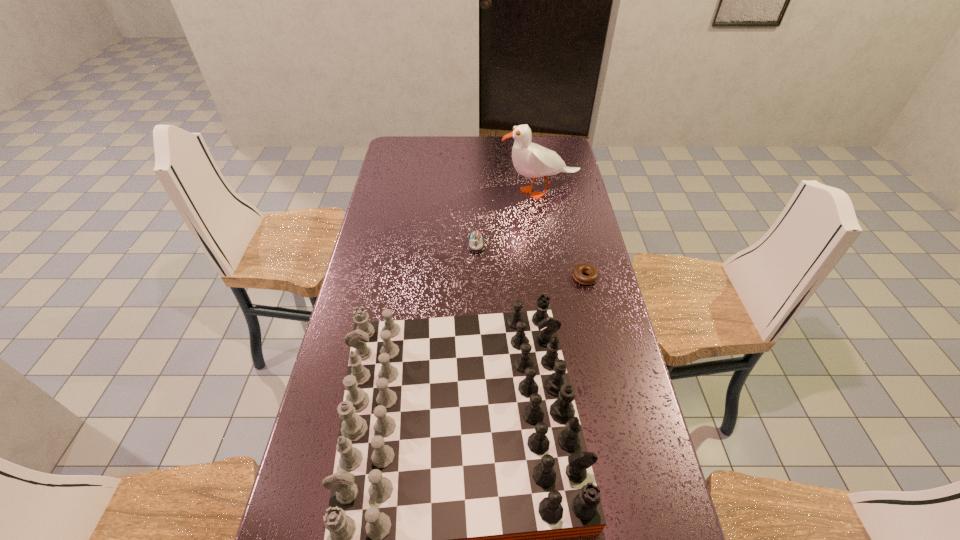
Where is `the tallest object`? the tallest object is located at coordinates (531, 160).

This screenshot has width=960, height=540. I want to click on the farthest object, so click(x=531, y=160).

The height and width of the screenshot is (540, 960). What are the coordinates of `the second farthest object` in the screenshot? It's located at (476, 244).

The height and width of the screenshot is (540, 960). In order to click on doughnut in this screenshot , I will do `click(593, 273)`.

The image size is (960, 540). Identify the location of vacant space located at the beak of the gull. (416, 192).

At what (x,y) coordinates should I click in order to perform the action: click on free space located 0.250m at the beak of the gull. Please return your answer as a coordinate pair (x, y). Looking at the image, I should click on (438, 192).

Where is `free space located at the beak of the gull`? This screenshot has height=540, width=960. free space located at the beak of the gull is located at coordinates (487, 192).

Where is `vacant space located 0.120m on the wheel side of the computer mouse`? This screenshot has height=540, width=960. vacant space located 0.120m on the wheel side of the computer mouse is located at coordinates (476, 278).

Where is `free spot located 0.330m on the left of the doughnut`? This screenshot has height=540, width=960. free spot located 0.330m on the left of the doughnut is located at coordinates (473, 278).

The image size is (960, 540). What are the coordinates of `gull that is at the right edge` in the screenshot? It's located at (531, 160).